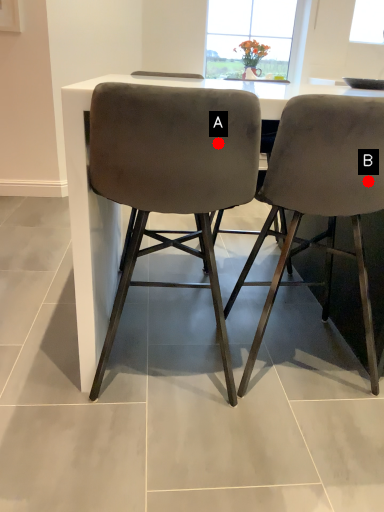
Question: Two points are circled on the image, labeled by A and B beside each circle. Which point appears closest to the camera in this image?

Choices:
 (A) A is closer
 (B) B is closer

Answer: (A)